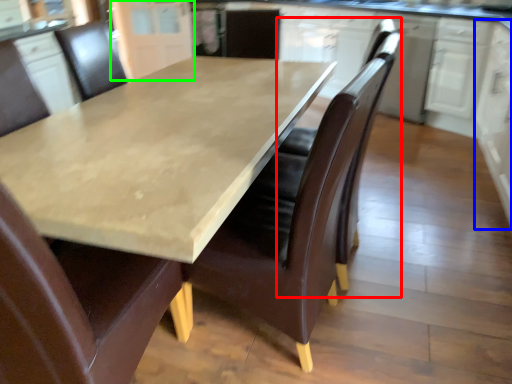
Question: Which object is the farthest from swivel chair (highlighted by a red box)? Choose among these: cabinetry (highlighted by a blue box) or cabinetry (highlighted by a green box).

Choices:
 (A) cabinetry
 (B) cabinetry

Answer: (B)